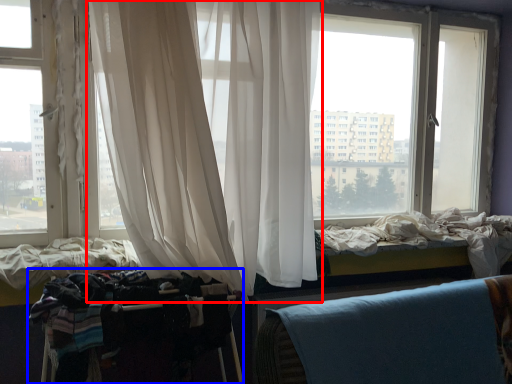
Question: Which of the following is the closest to the observer, curtain (highlighted by a red box) or baby carriage (highlighted by a blue box)?

Choices:
 (A) curtain
 (B) baby carriage

Answer: (A)